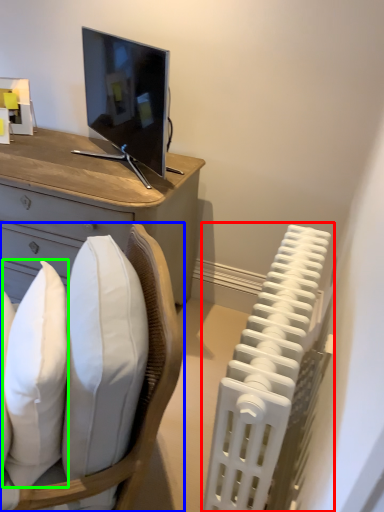
Question: Which object is positioned farthest from radiator (highlighted by a red box)? Select from chair (highlighted by a blue box) and pillow (highlighted by a green box).

Choices:
 (A) chair
 (B) pillow

Answer: (B)